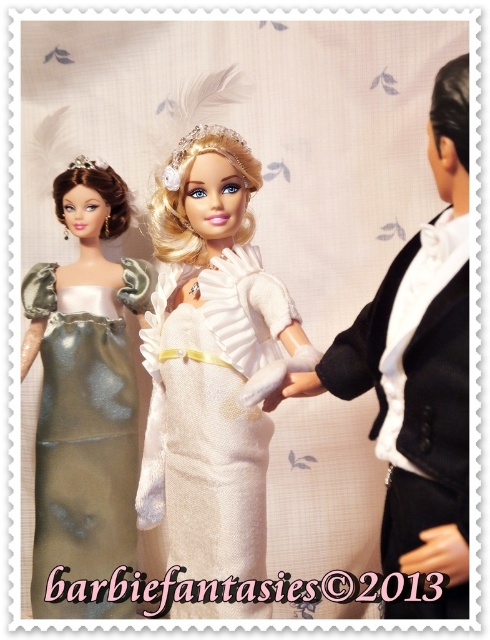
In the scene shown: Does satin metallic dress at left come in front of matte black hand at lower right?

No, satin metallic dress at left is further to the viewer.

Can you confirm if satin metallic dress at left is shorter than matte black hand at lower right?

No, satin metallic dress at left is not shorter than matte black hand at lower right.

Is point (106, 490) positioned after point (436, 557)?

Yes.

Image resolution: width=490 pixels, height=640 pixels. What are the coordinates of `satin metallic dress at left` in the screenshot? It's located at (81, 448).

Who is positioned more to the left, white textured dress at center or white satin glove at center?

white textured dress at center is more to the left.

Measure the distance between white textured dress at center and white satin glove at center.

The distance of white textured dress at center from white satin glove at center is 27.22 centimeters.

Is point (249, 288) less distant than point (305, 396)?

No, (249, 288) is further to viewer.

This screenshot has height=640, width=490. What are the coordinates of `white textured dress at center` in the screenshot? It's located at (209, 419).

Is white textured dress at center smaller than matte black hand at lower right?

Incorrect, white textured dress at center is not smaller in size than matte black hand at lower right.

This screenshot has height=640, width=490. In order to click on white textured dress at center in this screenshot , I will do `click(209, 419)`.